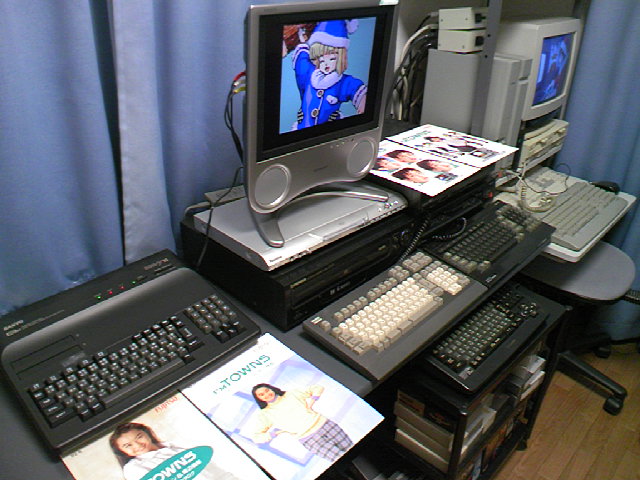
Find the location of a particular element. The image size is (640, 480). blue curtain is located at coordinates (32, 127), (159, 53), (600, 86).